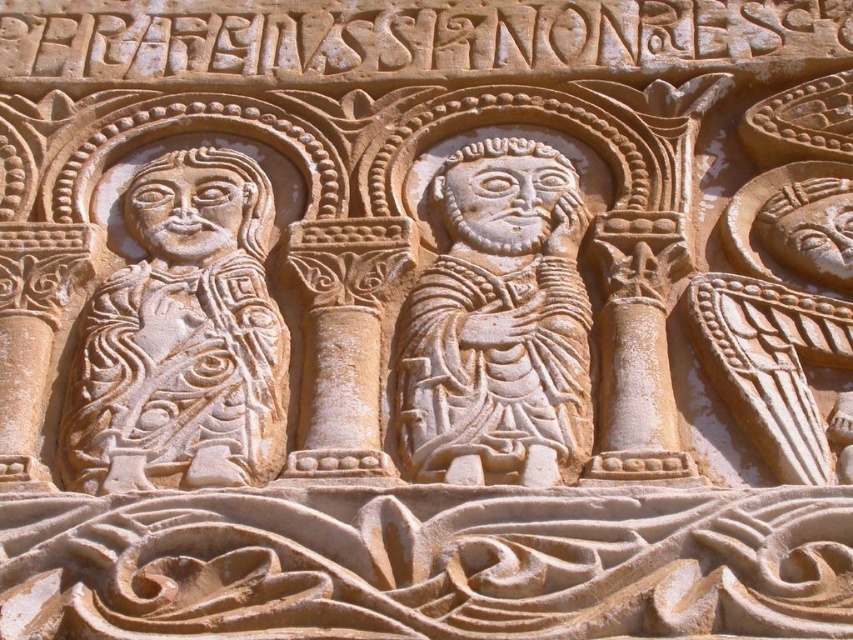
Between light beige stone figure at left and white stone figure at center, which one is positioned lower?

light beige stone figure at left is lower down.

Find the location of a particular element. light beige stone figure at left is located at coordinates (183, 339).